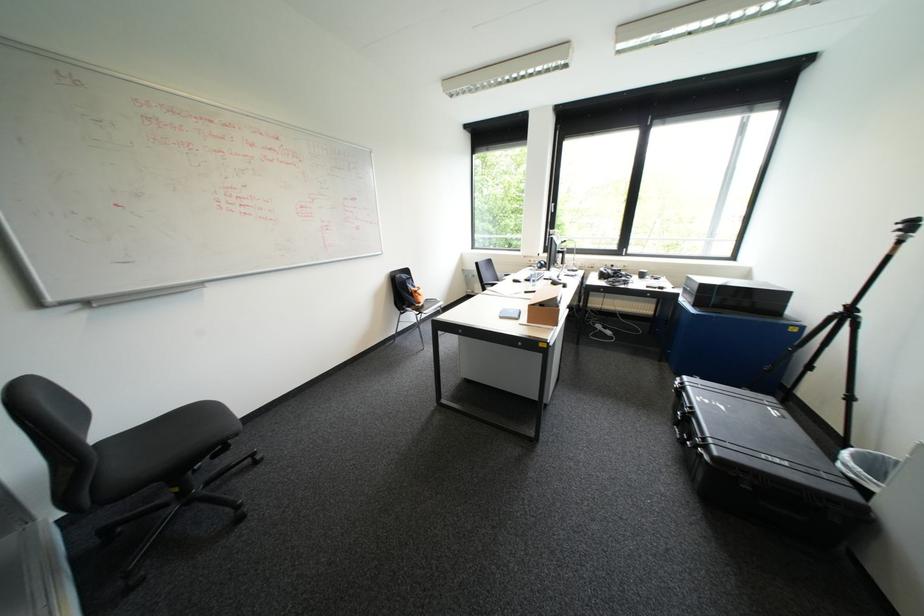
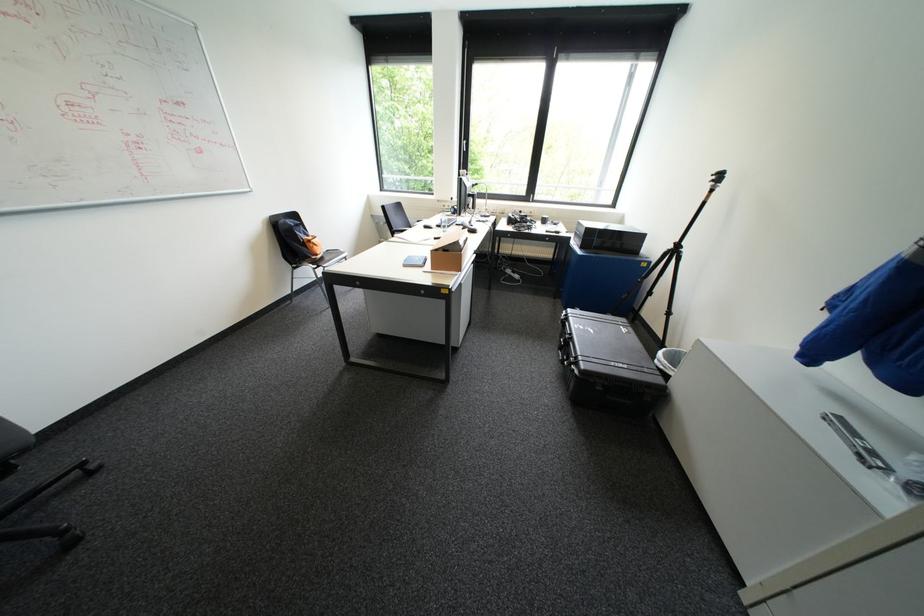
Locate, in the second image, the point that corresponds to (533,291) in the first image.

(444, 237)